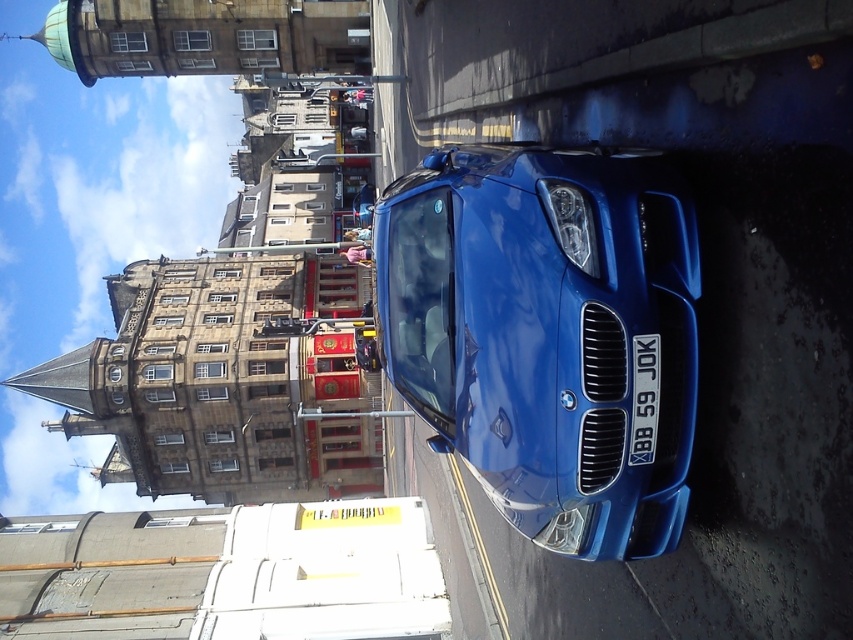
Is shiny blue car at center wider than white plastic license plate at center?

Correct, the width of shiny blue car at center exceeds that of white plastic license plate at center.

In the scene shown: Does shiny blue car at center have a greater height compared to white plastic license plate at center?

Yes.

You are a GUI agent. You are given a task and a screenshot of the screen. Output one action in this format:
    pyautogui.click(x=<x>, y=<y>)
    Task: Click on the shiny blue car at center
    The image size is (853, 640).
    Given the screenshot: What is the action you would take?
    pyautogui.click(x=544, y=332)